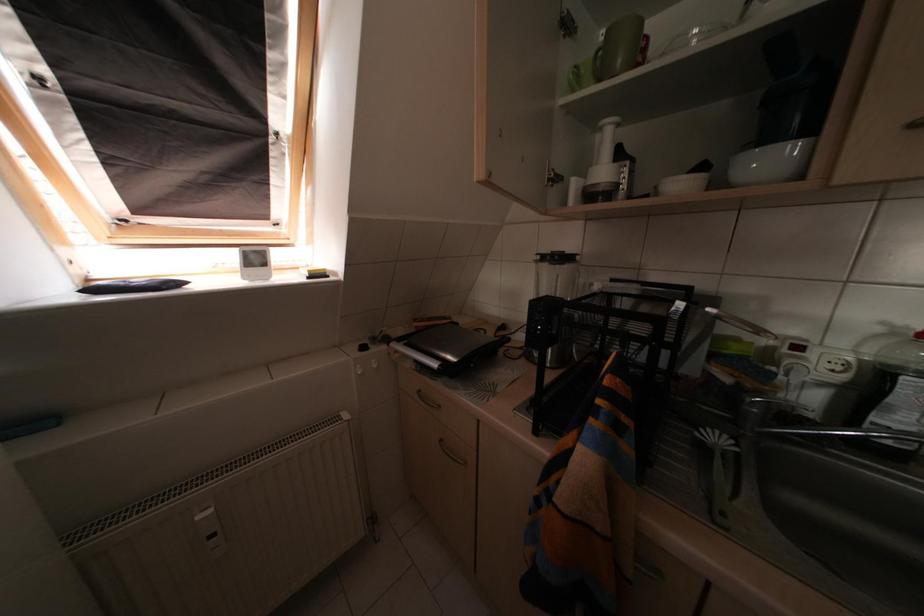
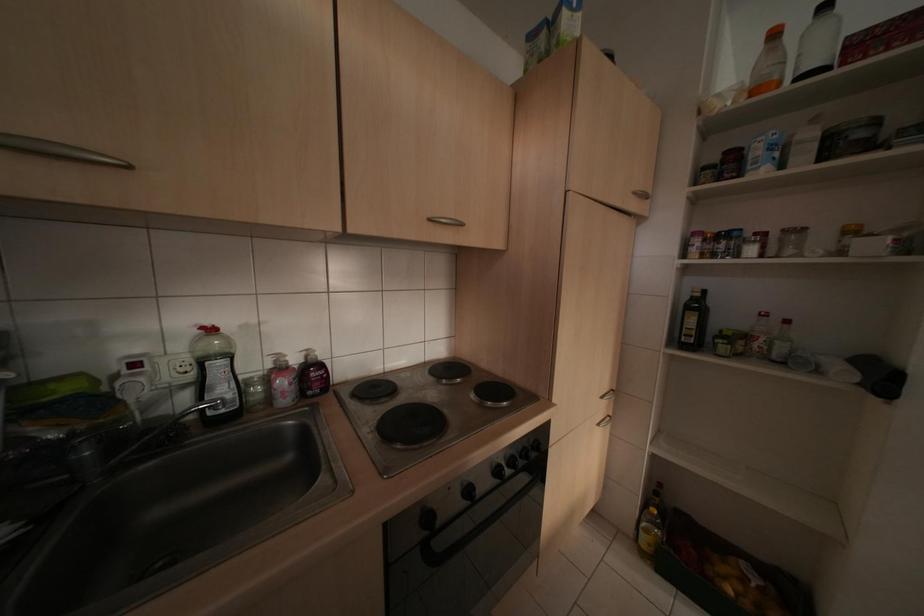
Question: The camera is either moving clockwise (left) or counter-clockwise (right) around the object. The first image is from the beginning of the video and the second image is from the end. Is the camera moving left or right when shooting the video?

Choices:
 (A) Left
 (B) Right

Answer: (A)